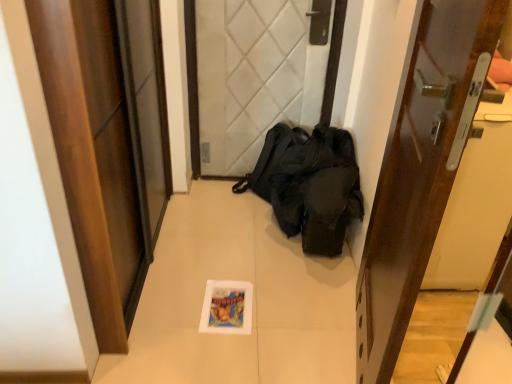
Locate an element on the screen. The image size is (512, 384). free space between wooden door at left, which appears as the 3th door when viewed from the right, and white quilted fabric at center, the second door positioned from the right is located at coordinates (205, 235).